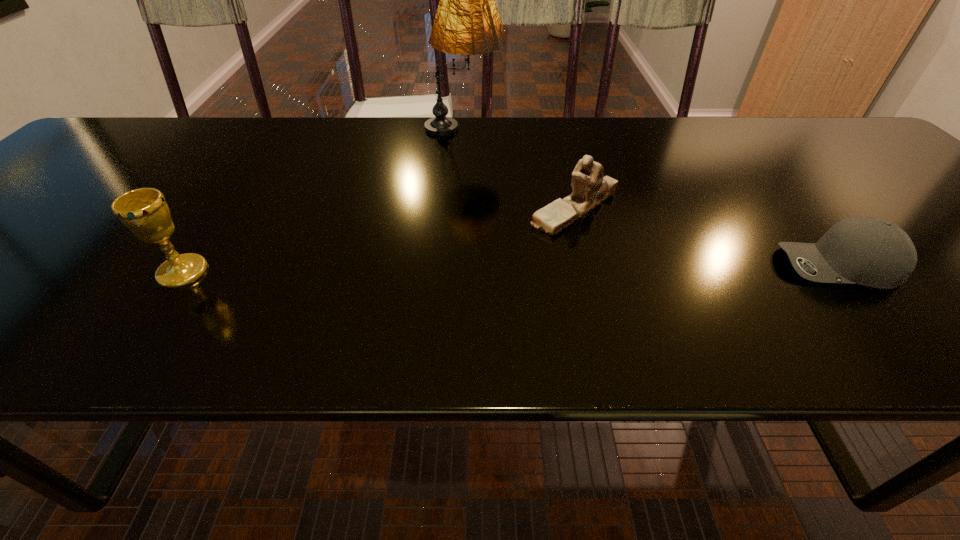
The image size is (960, 540). What are the coordinates of `vacant point located between the chalice and the third tallest object` in the screenshot? It's located at (378, 240).

The height and width of the screenshot is (540, 960). I want to click on free spot between the second tallest object and the third object from right to left, so click(324, 202).

The image size is (960, 540). I want to click on unoccupied position between the third shortest object and the rightmost object, so click(x=511, y=269).

The width and height of the screenshot is (960, 540). In order to click on vacant space that's between the second tallest object and the tallest object in this screenshot , I will do `click(324, 202)`.

At what (x,y) coordinates should I click in order to perform the action: click on vacant region between the baseball cap and the second farthest object. Please return your answer as a coordinate pair (x, y). Looking at the image, I should click on (707, 237).

Identify the location of free space between the chalice and the shortest object. The image size is (960, 540). (511, 269).

Where is `vacant region between the baseball cap and the tallest object`? The width and height of the screenshot is (960, 540). vacant region between the baseball cap and the tallest object is located at coordinates (651, 199).

You are a GUI agent. You are given a task and a screenshot of the screen. Output one action in this format:
    pyautogui.click(x=<x>, y=<y>)
    Task: Click on the unoccupied position between the shortest object and the tallest object
    This screenshot has width=960, height=540.
    Given the screenshot: What is the action you would take?
    pyautogui.click(x=651, y=199)

Locate an element on the screen. free spot between the lampshade and the third tallest object is located at coordinates (519, 170).

At what (x,y) coordinates should I click in order to perform the action: click on unoccupied position between the baseball cap and the leftmost object. Please return your answer as a coordinate pair (x, y). The width and height of the screenshot is (960, 540). Looking at the image, I should click on (511, 269).